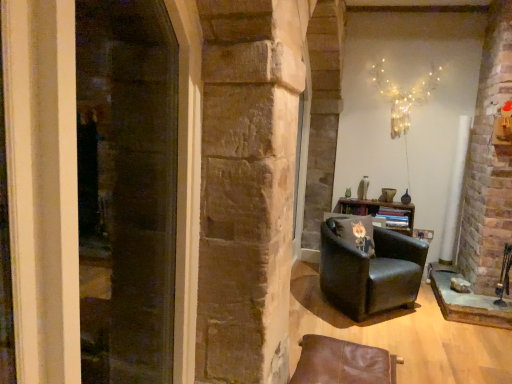
The height and width of the screenshot is (384, 512). I want to click on illuminated wire at upper center, so click(403, 95).

Measure the distance between point (356, 306) and camera.

The depth of point (356, 306) is 3.34 meters.

This screenshot has width=512, height=384. What do you see at coordinates (370, 272) in the screenshot?
I see `black leather armchair at center-right, which ranks as the 2th chair in front-to-back order` at bounding box center [370, 272].

Where is `transparent glass screen door at left`? This screenshot has height=384, width=512. transparent glass screen door at left is located at coordinates (126, 189).

Could you tell me if transparent glass screen door at left is facing black fabric pillow at center-right?

No.

From a real-world perspective, does transparent glass screen door at left stand above black fabric pillow at center-right?

Indeed, from a real-world perspective, transparent glass screen door at left stands above black fabric pillow at center-right.

Looking at this image, from the image's perspective, which is above, transparent glass screen door at left or black fabric pillow at center-right?

transparent glass screen door at left, from the image's perspective.

Can you confirm if transparent glass screen door at left is wider than black fabric pillow at center-right?

No.

From the image's perspective, does transparent glass screen door at left appear higher than black leather armchair at center-right, which ranks as the 2th chair in front-to-back order?

Indeed, from the image's perspective, transparent glass screen door at left is shown above black leather armchair at center-right, which ranks as the 2th chair in front-to-back order.

Between transparent glass screen door at left and black leather armchair at center-right, which is the 1th chair from back to front, which one has more height?

Standing taller between the two is transparent glass screen door at left.

Would you say transparent glass screen door at left is inside or outside black leather armchair at center-right, which is the 1th chair from back to front?

transparent glass screen door at left is outside black leather armchair at center-right, which is the 1th chair from back to front.

Does illuminated wire at upper center turn towards transparent glass screen door at left?

Yes.

Considering the relative sizes of illuminated wire at upper center and transparent glass screen door at left in the image provided, is illuminated wire at upper center smaller than transparent glass screen door at left?

No, illuminated wire at upper center is not smaller than transparent glass screen door at left.

From the image's perspective, which object appears higher, illuminated wire at upper center or transparent glass screen door at left?

illuminated wire at upper center, from the image's perspective.

This screenshot has height=384, width=512. In order to click on screen door directly beneath the illuminated wire at upper center (from a real-world perspective) in this screenshot , I will do `click(126, 189)`.

Can you confirm if illuminated wire at upper center is wider than black fabric pillow at center-right?

Correct, the width of illuminated wire at upper center exceeds that of black fabric pillow at center-right.

How far apart are illuminated wire at upper center and black fabric pillow at center-right?

A distance of 4.43 feet exists between illuminated wire at upper center and black fabric pillow at center-right.

From a real-world perspective, is illuminated wire at upper center physically above black fabric pillow at center-right?

Yes, from a real-world perspective, illuminated wire at upper center is over black fabric pillow at center-right

At what (x,y) coordinates should I click in order to perform the action: click on christmas light on the right of black fabric pillow at center-right. Please return your answer as a coordinate pair (x, y). Looking at the image, I should click on (403, 95).

Is illuminated wire at upper center placed right next to brown leather chair at lower right, which is the 2th chair from back to front?

illuminated wire at upper center is not next to brown leather chair at lower right, which is the 2th chair from back to front, and they're not touching.

From the image's perspective, is illuminated wire at upper center positioned above or below brown leather chair at lower right, which is the 2th chair from back to front?

Clearly, from the image's perspective, illuminated wire at upper center is above brown leather chair at lower right, which is the 2th chair from back to front.

Considering the sizes of objects illuminated wire at upper center and brown leather chair at lower right, which is counted as the 1th chair, starting from the front, in the image provided, who is wider, illuminated wire at upper center or brown leather chair at lower right, which is counted as the 1th chair, starting from the front,?

brown leather chair at lower right, which is counted as the 1th chair, starting from the front.

Is illuminated wire at upper center turned away from brown leather chair at lower right, which is the 2th chair from back to front?

illuminated wire at upper center is not turned away from brown leather chair at lower right, which is the 2th chair from back to front.

From the image's perspective, is brown leather chair at lower right, which is the 2th chair from back to front, above or below black leather armchair at center-right, which ranks as the 2th chair in front-to-back order?

Clearly, from the image's perspective, brown leather chair at lower right, which is the 2th chair from back to front, is below black leather armchair at center-right, which ranks as the 2th chair in front-to-back order.

Who is taller, brown leather chair at lower right, which is the 2th chair from back to front, or black leather armchair at center-right, which ranks as the 2th chair in front-to-back order?

With more height is black leather armchair at center-right, which ranks as the 2th chair in front-to-back order.

Is brown leather chair at lower right, which is counted as the 1th chair, starting from the front, wider or thinner than black leather armchair at center-right, which ranks as the 2th chair in front-to-back order?

Clearly, brown leather chair at lower right, which is counted as the 1th chair, starting from the front, has less width compared to black leather armchair at center-right, which ranks as the 2th chair in front-to-back order.

Is brown leather chair at lower right, which is the 2th chair from back to front, far away from black leather armchair at center-right, which is the 1th chair from back to front?

That's right, there is a large distance between brown leather chair at lower right, which is the 2th chair from back to front, and black leather armchair at center-right, which is the 1th chair from back to front.

From the image's perspective, is brown leather chair at lower right, which is the 2th chair from back to front, under transparent glass screen door at left?

Yes.

Is brown leather chair at lower right, which is the 2th chair from back to front, next to transparent glass screen door at left and touching it?

No, brown leather chair at lower right, which is the 2th chair from back to front, is not next to transparent glass screen door at left.

Does brown leather chair at lower right, which is counted as the 1th chair, starting from the front, come behind transparent glass screen door at left?

Yes, brown leather chair at lower right, which is counted as the 1th chair, starting from the front, is further from the viewer.

Does point (372, 353) come behind point (148, 35)?

Yes, point (372, 353) is farther from viewer.

What are the coordinates of `screen door in front of the black fabric pillow at center-right` in the screenshot? It's located at (126, 189).

You are a GUI agent. You are given a task and a screenshot of the screen. Output one action in this format:
    pyautogui.click(x=<x>, y=<y>)
    Task: Click on the 2nd chair behind the transparent glass screen door at left, counting from the anchor's position
    The height and width of the screenshot is (384, 512).
    Given the screenshot: What is the action you would take?
    pyautogui.click(x=370, y=272)

When comparing their distances from brown leather chair at lower right, which is the 2th chair from back to front, does black fabric pillow at center-right or black leather armchair at center-right, which ranks as the 2th chair in front-to-back order, seem further?

black fabric pillow at center-right.

Based on their spatial positions, is brown leather chair at lower right, which is counted as the 1th chair, starting from the front, or black leather armchair at center-right, which ranks as the 2th chair in front-to-back order, closer to transparent glass screen door at left?

black leather armchair at center-right, which ranks as the 2th chair in front-to-back order, lies closer to transparent glass screen door at left than the other object.

Looking at the image, which one is located closer to transparent glass screen door at left, brown leather chair at lower right, which is counted as the 1th chair, starting from the front, or illuminated wire at upper center?

brown leather chair at lower right, which is counted as the 1th chair, starting from the front, is positioned closer to the anchor transparent glass screen door at left.

When comparing their distances from black leather armchair at center-right, which ranks as the 2th chair in front-to-back order, does transparent glass screen door at left or brown leather chair at lower right, which is the 2th chair from back to front, seem closer?

brown leather chair at lower right, which is the 2th chair from back to front, lies closer to black leather armchair at center-right, which ranks as the 2th chair in front-to-back order, than the other object.

Which object lies nearer to the anchor point brown leather chair at lower right, which is counted as the 1th chair, starting from the front, black leather armchair at center-right, which ranks as the 2th chair in front-to-back order, or illuminated wire at upper center?

Among the two, black leather armchair at center-right, which ranks as the 2th chair in front-to-back order, is located nearer to brown leather chair at lower right, which is counted as the 1th chair, starting from the front.

Estimate the real-world distances between objects in this image. Which object is closer to black fabric pillow at center-right, illuminated wire at upper center or black leather armchair at center-right, which is the 1th chair from back to front?

black leather armchair at center-right, which is the 1th chair from back to front, lies closer to black fabric pillow at center-right than the other object.

Considering their positions, is transparent glass screen door at left positioned further to illuminated wire at upper center than black leather armchair at center-right, which is the 1th chair from back to front?

Among the two, transparent glass screen door at left is located further to illuminated wire at upper center.

From the image, which object appears to be farther from illuminated wire at upper center, black fabric pillow at center-right or transparent glass screen door at left?

The object further to illuminated wire at upper center is transparent glass screen door at left.

At what (x,y) coordinates should I click in order to perform the action: click on pillow positioned between brown leather chair at lower right, which is counted as the 1th chair, starting from the front, and illuminated wire at upper center from near to far. Please return your answer as a coordinate pair (x, y). This screenshot has width=512, height=384. Looking at the image, I should click on (357, 233).

At what (x,y) coordinates should I click in order to perform the action: click on chair between transparent glass screen door at left and black leather armchair at center-right, which is the 1th chair from back to front, from front to back. Please return your answer as a coordinate pair (x, y). Looking at the image, I should click on (343, 362).

Locate an element on the screen. chair positioned between brown leather chair at lower right, which is the 2th chair from back to front, and illuminated wire at upper center from near to far is located at coordinates (370, 272).

Identify the location of chair located between brown leather chair at lower right, which is counted as the 1th chair, starting from the front, and black fabric pillow at center-right in the depth direction. [370, 272].